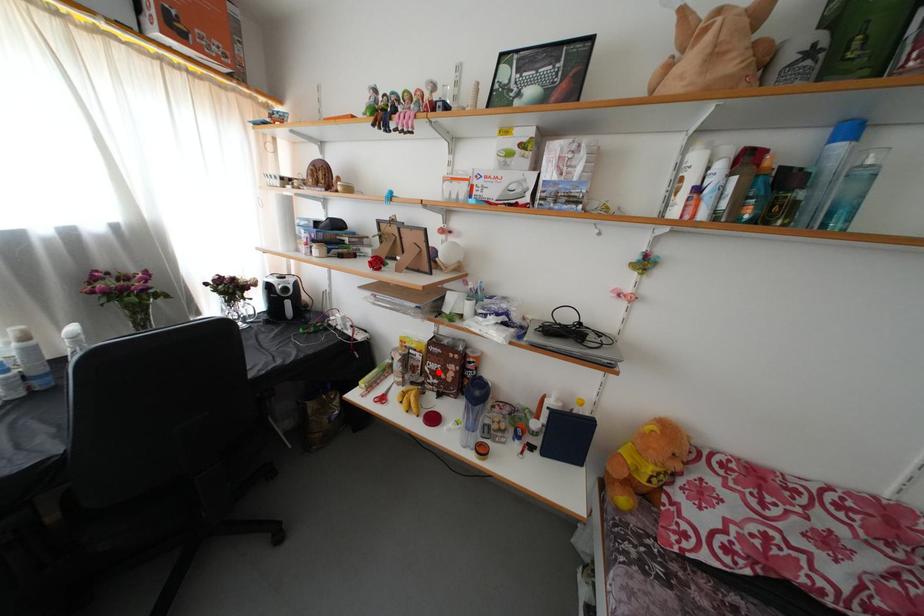
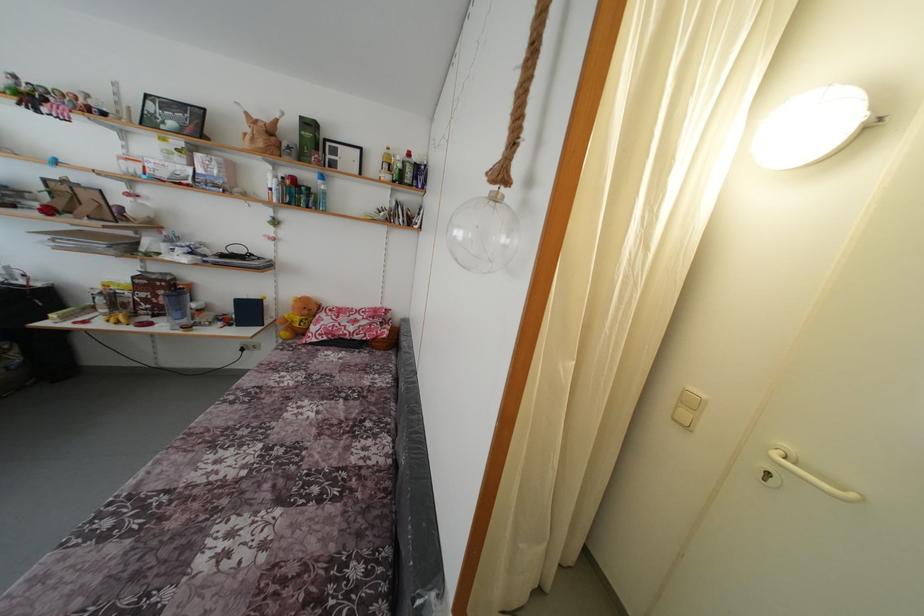
Question: A red point is marked in image1. In image2, is the corresponding 3D point closer to the camera or farther? Reply with the corresponding letter.

Choices:
 (A) The corresponding 3D point is closer.
 (B) The corresponding 3D point is farther.

Answer: (A)